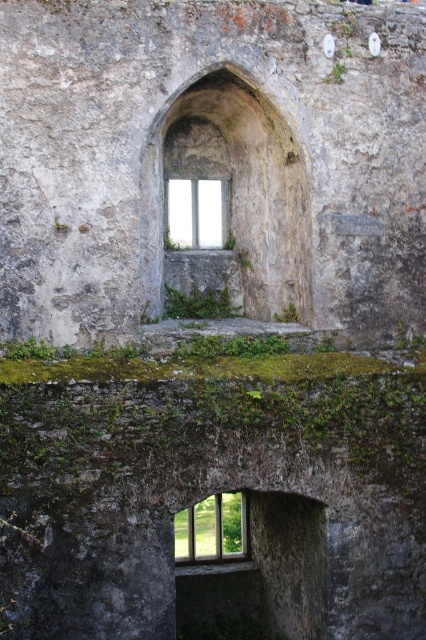
Based on the photo, you are standing 10 meters away from the old stone structure. You want to reach the point marked at coordinates point (212, 554). Is the point closer to you than the structure itself?

The distance of point (212, 554) from viewer is 10.72 meters, which is farther than your current position at 10 meters away from the structure. Therefore, the point is further away than the structure itself.

You are an architect examining an old stone structure. You need to locate the clear glass window at center. Where exactly is it positioned in the image?

The clear glass window at center is positioned at point coordinates of 0.827 on the x axis and 0.498 on the y axis.